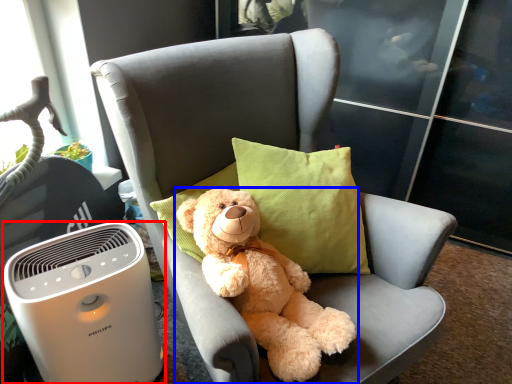
Question: Which object is closer to the camera taking this photo, home appliance (highlighted by a red box) or teddy bear (highlighted by a blue box)?

Choices:
 (A) home appliance
 (B) teddy bear

Answer: (B)